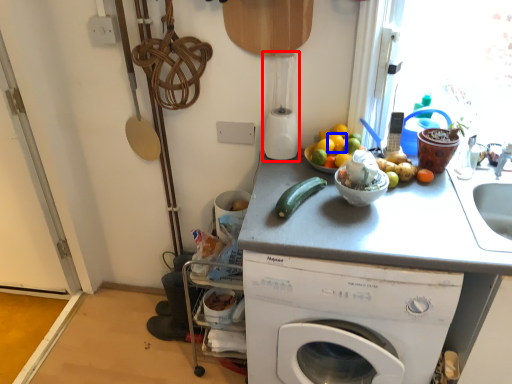
Question: Which point is closer to the camera, blender (highlighted by a red box) or orange (highlighted by a blue box)?

Choices:
 (A) blender
 (B) orange

Answer: (A)